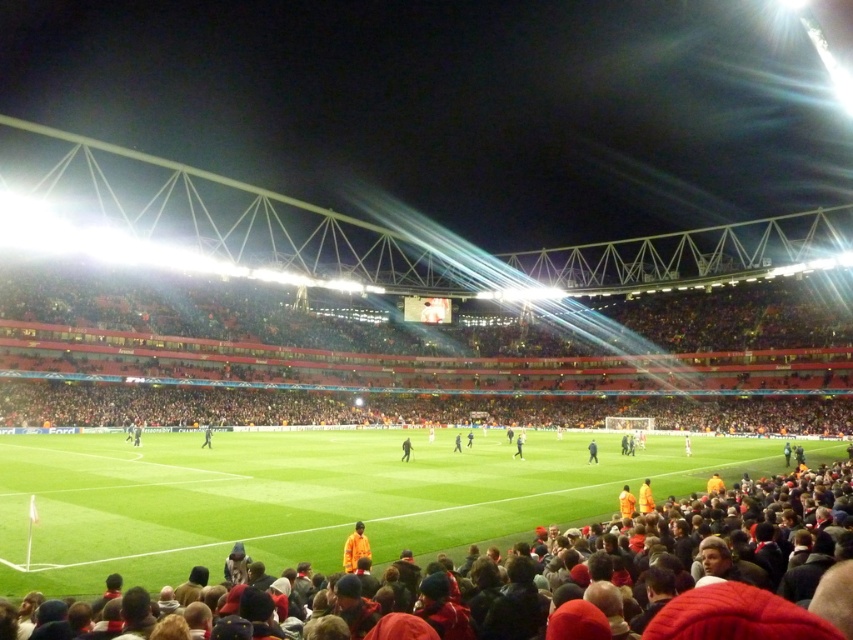
Question: Estimate the real-world distances between objects in this image. Which object is closer to the orange reflective vest at center?

Choices:
 (A) orange waterproof jacket at lower center
 (B) black fabric person at center

Answer: (B)

Question: Among these objects, which one is nearest to the camera?

Choices:
 (A) orange reflective vest at center
 (B) black fabric person at center
 (C) dark blue fabric jacket at center
 (D) green grass at center

Answer: (D)

Question: Does dark brown leather jacket at center appear on the left side of black fabric person at center?

Choices:
 (A) yes
 (B) no

Answer: (A)

Question: Estimate the real-world distances between objects in this image. Which object is closer to the orange waterproof jacket at lower center?

Choices:
 (A) green grass at center
 (B) dark blue fabric jacket at center
 (C) black fabric person at center

Answer: (A)

Question: Is dark blue fabric jacket at center bigger than orange reflective vest at center?

Choices:
 (A) yes
 (B) no

Answer: (A)

Question: Is dark blue fabric jacket at center below dark brown leather jacket at center?

Choices:
 (A) no
 (B) yes

Answer: (B)